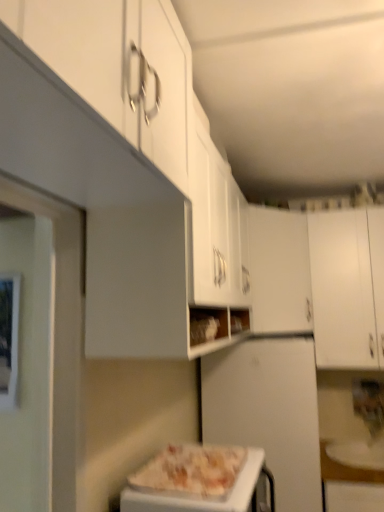
Question: From the image's perspective, relative to white matte cabinet at right, the first cabinetry viewed from the right, is white matte cabinet at center, arranged as the first cabinetry when viewed from the left, above or below?

Choices:
 (A) above
 (B) below

Answer: (A)

Question: Is white matte cabinet at center, arranged as the first cabinetry when viewed from the left, wider or thinner than white matte cabinet at right, the first cabinetry viewed from the right?

Choices:
 (A) thin
 (B) wide

Answer: (B)

Question: Which object is the closest to the white matte cabinet at center, arranged as the first cabinetry when viewed from the left?

Choices:
 (A) white matte refrigerator at center
 (B) white matte cabinet at right, the second cabinetry from the left
 (C) white glossy pizza at center
 (D) white glossy plate at lower right

Answer: (B)

Question: Estimate the real-world distances between objects in this image. Which object is farther from the white matte cabinet at right, the second cabinetry from the left?

Choices:
 (A) white glossy pizza at center
 (B) white matte cabinet at center, arranged as the first cabinetry when viewed from the left
 (C) white glossy plate at lower right
 (D) white matte refrigerator at center

Answer: (A)